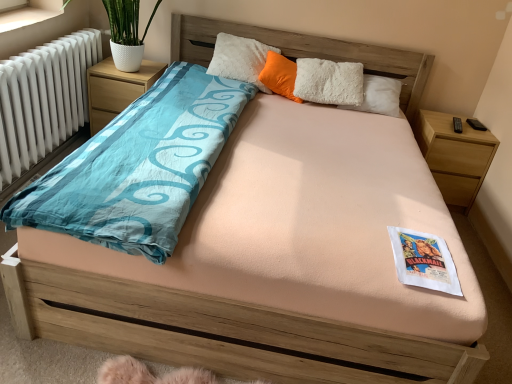
Question: From a real-world perspective, is orange fluffy pillow at center above or below white paper at center?

Choices:
 (A) below
 (B) above

Answer: (B)

Question: Based on their sizes in the image, would you say orange fluffy pillow at center is bigger or smaller than white paper at center?

Choices:
 (A) small
 (B) big

Answer: (B)

Question: Which object is the farthest from the orange fluffy pillow at center?

Choices:
 (A) white paper at center
 (B) white smooth window sill at upper left
 (C) wooden nightstand at right, the 2th nightstand from the left
 (D) white matte radiator at left
 (E) wooden nightstand at left, the 2th nightstand from the right

Answer: (A)

Question: Which of these objects is positioned farthest from the orange fluffy pillow at center?

Choices:
 (A) wooden nightstand at left, the 2th nightstand from the right
 (B) white paper at center
 (C) white matte radiator at left
 (D) wooden nightstand at right, the 1th nightstand in the right-to-left sequence
 (E) white smooth window sill at upper left

Answer: (B)